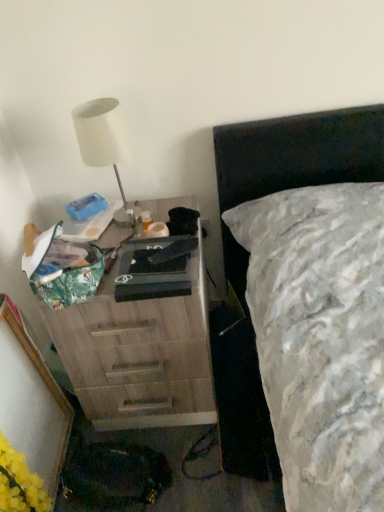
Image resolution: width=384 pixels, height=512 pixels. What do you see at coordinates (138, 351) in the screenshot?
I see `wooden chest of drawers at left` at bounding box center [138, 351].

The height and width of the screenshot is (512, 384). I want to click on wooden chest of drawers at left, so click(x=138, y=351).

Is yellow matte flower at lower left aimed at white matte lamp at upper left?

No, yellow matte flower at lower left is not oriented towards white matte lamp at upper left.

Considering the sizes of objects yellow matte flower at lower left and white matte lamp at upper left in the image provided, who is shorter, yellow matte flower at lower left or white matte lamp at upper left?

white matte lamp at upper left.

Locate an element on the screen. This screenshot has height=512, width=384. flower located underneath the white matte lamp at upper left (from a real-world perspective) is located at coordinates (20, 483).

Is yellow matte flower at lower left facing towards wooden chest of drawers at left?

No, yellow matte flower at lower left does not turn towards wooden chest of drawers at left.

Is yellow matte flower at lower left not close to wooden chest of drawers at left?

yellow matte flower at lower left is near wooden chest of drawers at left, not far away.

Who is shorter, yellow matte flower at lower left or wooden chest of drawers at left?

Standing shorter between the two is yellow matte flower at lower left.

From the image's perspective, who appears lower, yellow matte flower at lower left or wooden chest of drawers at left?

From the image's view, yellow matte flower at lower left is below.

Is the position of white matte lamp at upper left more distant than that of wooden chest of drawers at left?

Yes, it is behind wooden chest of drawers at left.

How different are the orientations of white matte lamp at upper left and wooden chest of drawers at left in degrees?

0.00166 degrees separate the facing orientations of white matte lamp at upper left and wooden chest of drawers at left.

I want to click on the chest of drawers located below the white matte lamp at upper left (from the image's perspective), so click(x=138, y=351).

From a real-world perspective, which is physically below, white matte lamp at upper left or wooden chest of drawers at left?

wooden chest of drawers at left, from a real-world perspective.

From a real-world perspective, is wooden chest of drawers at left positioned above or below yellow matte flower at lower left?

wooden chest of drawers at left is situated higher than yellow matte flower at lower left in the real world.

Looking at the image, does wooden chest of drawers at left seem bigger or smaller compared to yellow matte flower at lower left?

In the image, wooden chest of drawers at left appears to be larger than yellow matte flower at lower left.

Looking at this image, from the image's perspective, which object appears higher, wooden chest of drawers at left or yellow matte flower at lower left?

From the image's view, wooden chest of drawers at left is above.

Can you confirm if wooden chest of drawers at left is shorter than yellow matte flower at lower left?

No.

Is white matte lamp at upper left bigger or smaller than yellow matte flower at lower left?

In the image, white matte lamp at upper left appears to be larger than yellow matte flower at lower left.

This screenshot has height=512, width=384. What are the coordinates of `lamp above the yellow matte flower at lower left (from a real-world perspective)` in the screenshot? It's located at (105, 145).

Which object is positioned more to the right, white matte lamp at upper left or yellow matte flower at lower left?

From the viewer's perspective, white matte lamp at upper left appears more on the right side.

Can you confirm if wooden chest of drawers at left is shorter than white matte lamp at upper left?

No.

Does wooden chest of drawers at left have a lesser width compared to white matte lamp at upper left?

In fact, wooden chest of drawers at left might be wider than white matte lamp at upper left.

Considering the points (92, 320) and (105, 148), which point is behind, point (92, 320) or point (105, 148)?

The point (105, 148) is behind.

Would you consider wooden chest of drawers at left to be distant from white matte lamp at upper left?

No, there isn't a large distance between wooden chest of drawers at left and white matte lamp at upper left.

Find the location of `lamp behind the yellow matte flower at lower left`. lamp behind the yellow matte flower at lower left is located at coordinates (105, 145).

Locate an element on the screen. The image size is (384, 512). chest of drawers on the right side of yellow matte flower at lower left is located at coordinates (138, 351).

In the scene shown: When comparing their distances from wooden chest of drawers at left, does yellow matte flower at lower left or white matte lamp at upper left seem closer?

yellow matte flower at lower left is positioned closer to the anchor wooden chest of drawers at left.

Estimate the real-world distances between objects in this image. Which object is further from wooden chest of drawers at left, white matte lamp at upper left or yellow matte flower at lower left?

The object further to wooden chest of drawers at left is white matte lamp at upper left.

Which object lies nearer to the anchor point yellow matte flower at lower left, wooden chest of drawers at left or white matte lamp at upper left?

wooden chest of drawers at left lies closer to yellow matte flower at lower left than the other object.

Looking at the image, which one is located further to white matte lamp at upper left, wooden chest of drawers at left or yellow matte flower at lower left?

The object further to white matte lamp at upper left is yellow matte flower at lower left.

Looking at the image, which one is located further to white matte lamp at upper left, yellow matte flower at lower left or wooden chest of drawers at left?

yellow matte flower at lower left.

Estimate the real-world distances between objects in this image. Which object is closer to yellow matte flower at lower left, white matte lamp at upper left or wooden chest of drawers at left?

The object closer to yellow matte flower at lower left is wooden chest of drawers at left.

Identify the location of chest of drawers between white matte lamp at upper left and yellow matte flower at lower left in the vertical direction. This screenshot has width=384, height=512. pos(138,351).